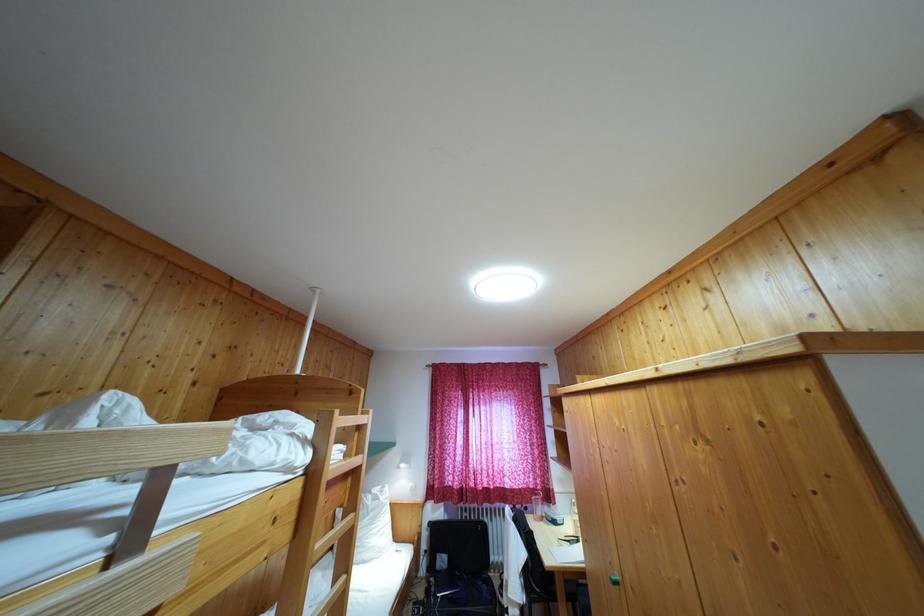
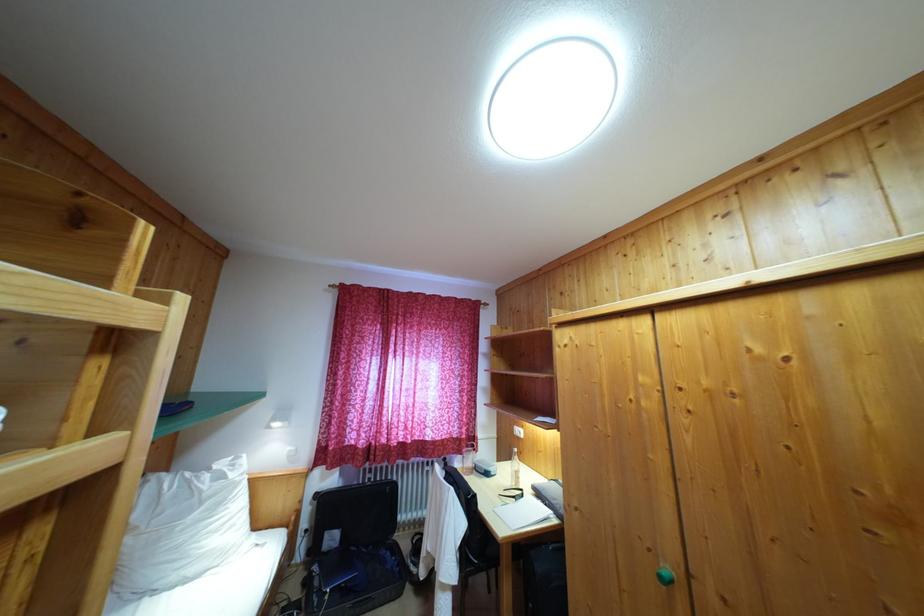
The point at (373, 499) is marked in the first image. Where is the corresponding point in the second image?

(213, 476)